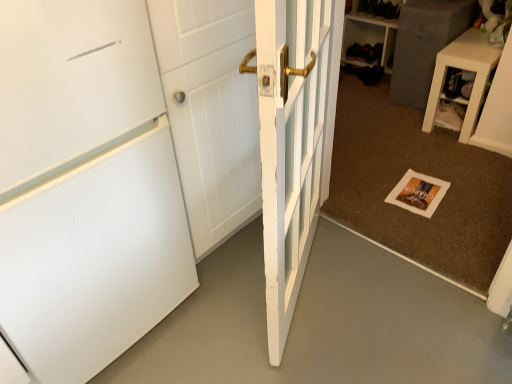
Question: Is white matte refrigerator at left not near black leather shoe at upper center?

Choices:
 (A) no
 (B) yes

Answer: (B)

Question: Is the surface of white matte refrigerator at left in direct contact with black leather shoe at upper center?

Choices:
 (A) no
 (B) yes

Answer: (A)

Question: Does white matte refrigerator at left have a lesser height compared to black leather shoe at upper center?

Choices:
 (A) yes
 (B) no

Answer: (A)

Question: Is the position of white matte refrigerator at left less distant than that of black leather shoe at upper center?

Choices:
 (A) no
 (B) yes

Answer: (B)

Question: From a real-world perspective, is white matte refrigerator at left beneath black leather shoe at upper center?

Choices:
 (A) no
 (B) yes

Answer: (B)

Question: From the image's perspective, is white matte refrigerator at left over black leather shoe at upper center?

Choices:
 (A) yes
 (B) no

Answer: (B)

Question: Does black leather shoe at upper center have a lesser height compared to white matte door at left, which is the 2th door from right to left?

Choices:
 (A) yes
 (B) no

Answer: (A)

Question: Is black leather shoe at upper center taller than white matte door at left, which is the 2th door from right to left?

Choices:
 (A) yes
 (B) no

Answer: (B)

Question: Is black leather shoe at upper center oriented towards white matte door at left, marked as the first door in a left-to-right arrangement?

Choices:
 (A) no
 (B) yes

Answer: (B)

Question: Is black leather shoe at upper center far from white matte door at left, marked as the first door in a left-to-right arrangement?

Choices:
 (A) yes
 (B) no

Answer: (A)

Question: Is black leather shoe at upper center further to the viewer compared to white matte door at left, marked as the first door in a left-to-right arrangement?

Choices:
 (A) yes
 (B) no

Answer: (A)

Question: Is black leather shoe at upper center positioned beyond the bounds of white matte door at left, which is the 2th door from right to left?

Choices:
 (A) no
 (B) yes

Answer: (B)

Question: Is white matte refrigerator at left behind white glossy side table at upper right?

Choices:
 (A) yes
 (B) no

Answer: (B)